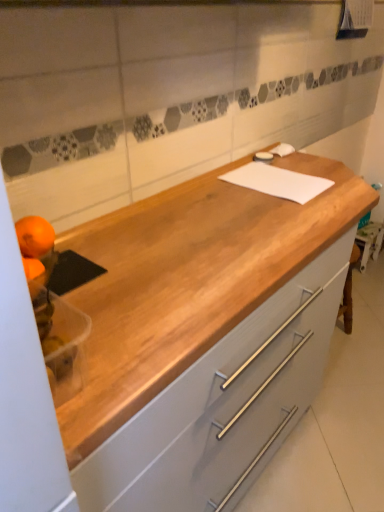
Question: Considering the positions of light gray wood cabinet at center and white matte cutting board at center in the image, is light gray wood cabinet at center taller or shorter than white matte cutting board at center?

Choices:
 (A) tall
 (B) short

Answer: (A)

Question: In terms of width, does light gray wood cabinet at center look wider or thinner when compared to white matte cutting board at center?

Choices:
 (A) thin
 (B) wide

Answer: (B)

Question: Which of these objects is positioned farthest from the light gray wood cabinet at center?

Choices:
 (A) white matte cutting board at center
 (B) orange matte at left, marked as the 2th orange in a top-to-bottom arrangement
 (C) orangesmoothfruit at left, which is the first orange from top to bottom

Answer: (C)

Question: Estimate the real-world distances between objects in this image. Which object is closer to the light gray wood cabinet at center?

Choices:
 (A) orangesmoothfruit at left, which appears as the second orange when ordered from the bottom
 (B) white matte cutting board at center
 (C) orange matte at left, the first orange positioned from the bottom

Answer: (B)